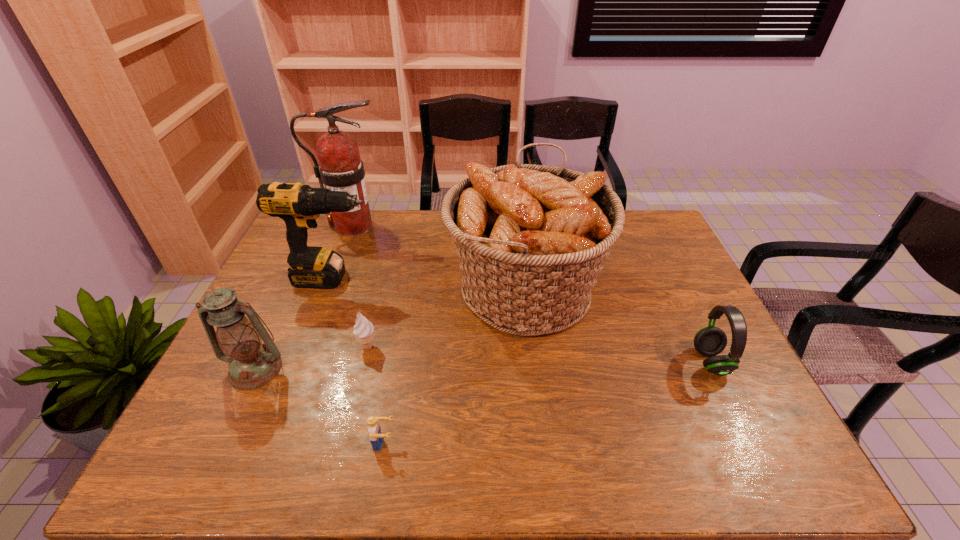
Where is `fire extinguisher`? The height and width of the screenshot is (540, 960). fire extinguisher is located at coordinates (340, 168).

At what (x,y) coordinates should I click in order to perform the action: click on the tallest object. Please return your answer as a coordinate pair (x, y). Looking at the image, I should click on (340, 168).

Find the location of a particular element. the second object from right to left is located at coordinates (531, 239).

At what (x,y) coordinates should I click in order to perform the action: click on drill. Please return your answer as a coordinate pair (x, y). This screenshot has height=540, width=960. Looking at the image, I should click on (299, 206).

Find the location of a particular element. The width and height of the screenshot is (960, 540). the fourth shortest object is located at coordinates (252, 364).

Locate an element on the screen. the rightmost object is located at coordinates (710, 341).

I want to click on the fifth tallest object, so click(710, 341).

This screenshot has width=960, height=540. I want to click on icecream, so click(x=363, y=329).

This screenshot has height=540, width=960. Identify the location of the shortest object. (376, 437).

What are the coordinates of `the nearest object` in the screenshot? It's located at (376, 437).